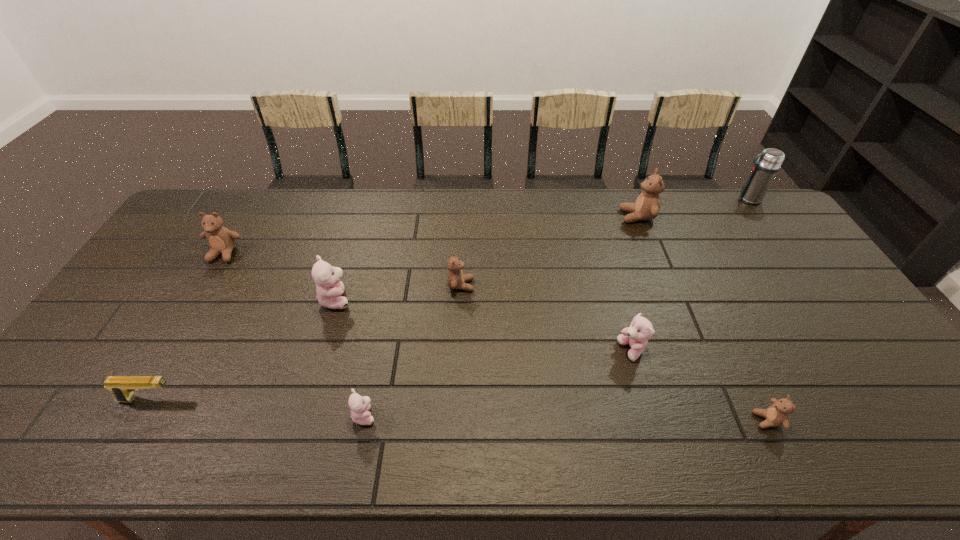
Identify the location of vacant space at the near edge of the desktop. (123, 427).

Locate an element on the screen. The width and height of the screenshot is (960, 540). vacant region at the left edge of the desktop is located at coordinates (165, 283).

At what (x,y) coordinates should I click in order to perform the action: click on vacant space at the near right corner of the desktop. Please return your answer as a coordinate pair (x, y). This screenshot has width=960, height=540. Looking at the image, I should click on (921, 457).

Find the location of a particular element. unoccupied position between the second smallest pink teddy bear and the third brown teddy bear from left to right is located at coordinates (635, 284).

Locate an element on the screen. The image size is (960, 540). empty space between the rightmost object and the fourth object from left to right is located at coordinates coord(556,307).

Find the location of a particular element. The image size is (960, 540). free space between the fourth nearest object and the second farthest brown teddy bear is located at coordinates (428, 302).

Locate an element on the screen. The height and width of the screenshot is (540, 960). blank region between the smallest pink teddy bear and the biggest pink teddy bear is located at coordinates (350, 357).

This screenshot has width=960, height=540. What are the coordinates of `free spot between the nearest brown teddy bear and the second pink teddy bear from right to left` in the screenshot? It's located at (565, 418).

At what (x,y) coordinates should I click in order to perform the action: click on free space between the third brown teddy bear from left to right and the thermos bottle. Please return your answer as a coordinate pair (x, y). The image size is (960, 540). Looking at the image, I should click on (692, 208).

Locate an element on the screen. This screenshot has width=960, height=540. free space between the rightmost object and the second nearest pink teddy bear is located at coordinates (690, 275).